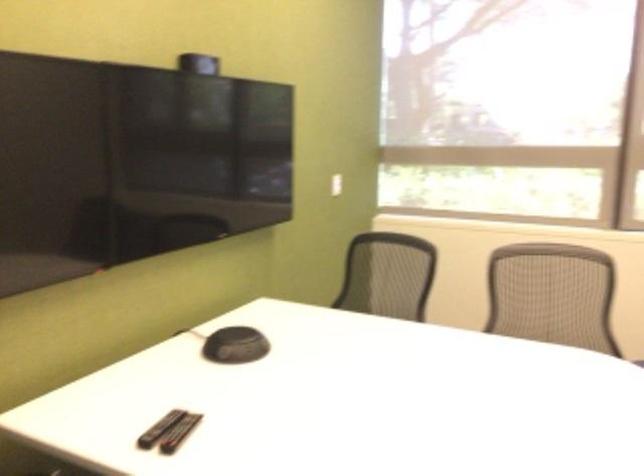
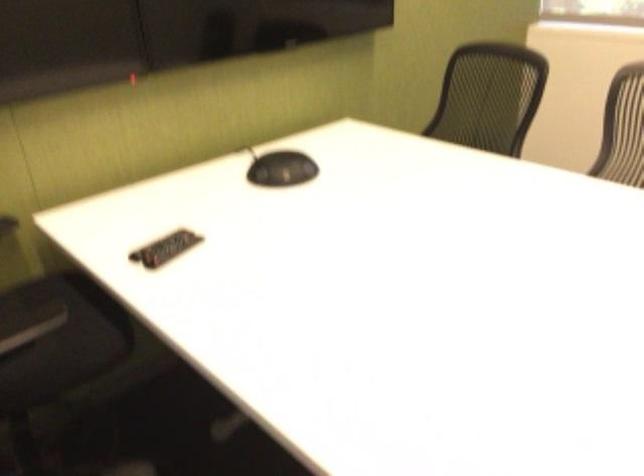
Which direction would the cameraman need to move to produce the second image?

The cameraman walked toward right, forward.